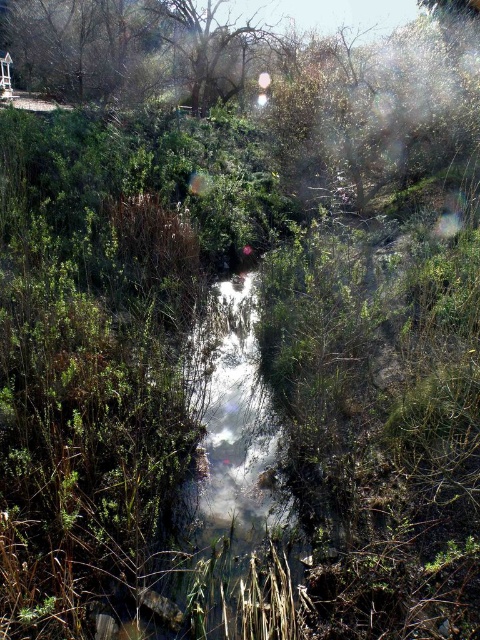
Who is more forward, (346, 93) or (172, 28)?

Point (346, 93) is in front.

Is green leafy tree at upper center to the left of brown textured tree at upper center from the viewer's perspective?

Incorrect, green leafy tree at upper center is not on the left side of brown textured tree at upper center.

Is point (332, 136) in front of point (204, 61)?

Yes.

Where is `green leafy tree at upper center`? green leafy tree at upper center is located at coordinates (377, 106).